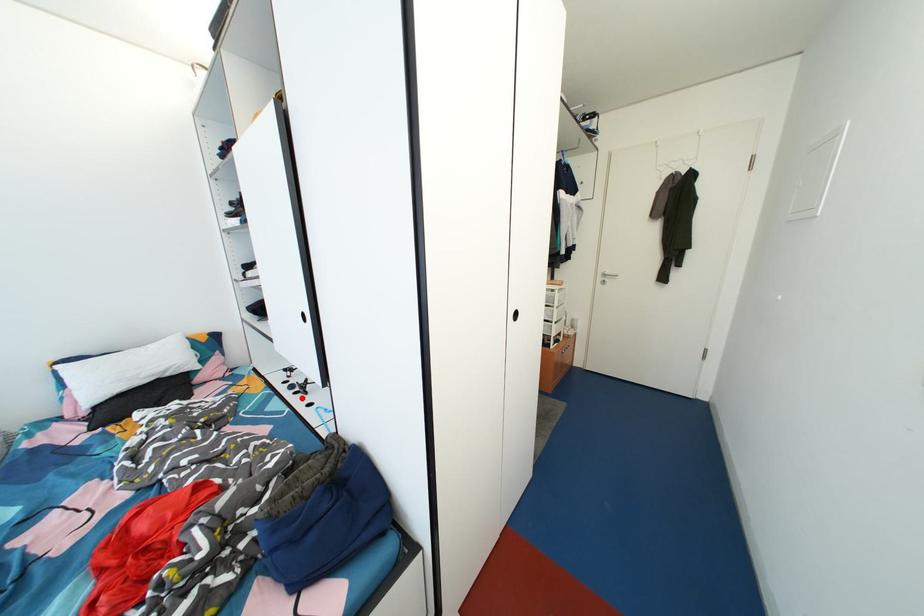
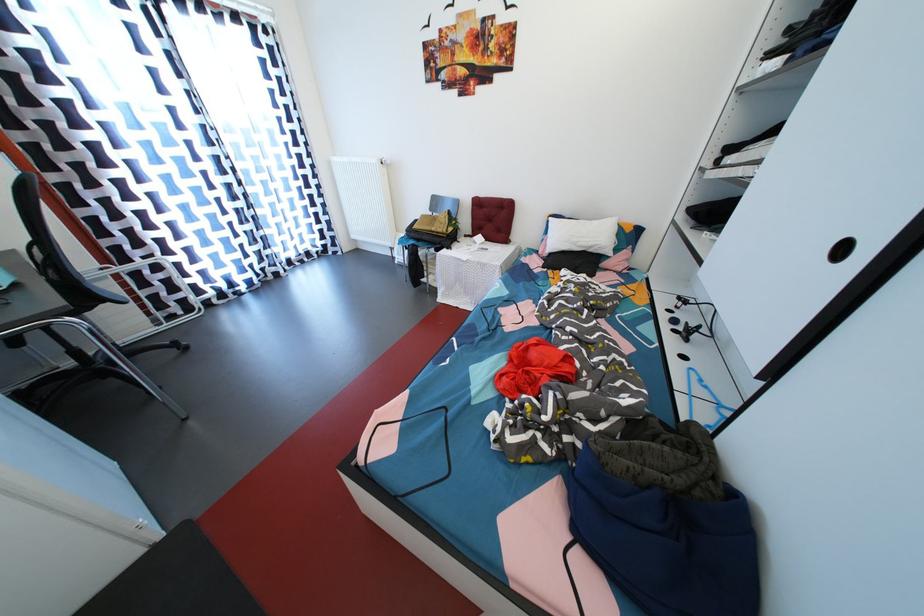
The point at the highlighted location is marked in the first image. Where is the corresponding point in the second image?

(681, 336)